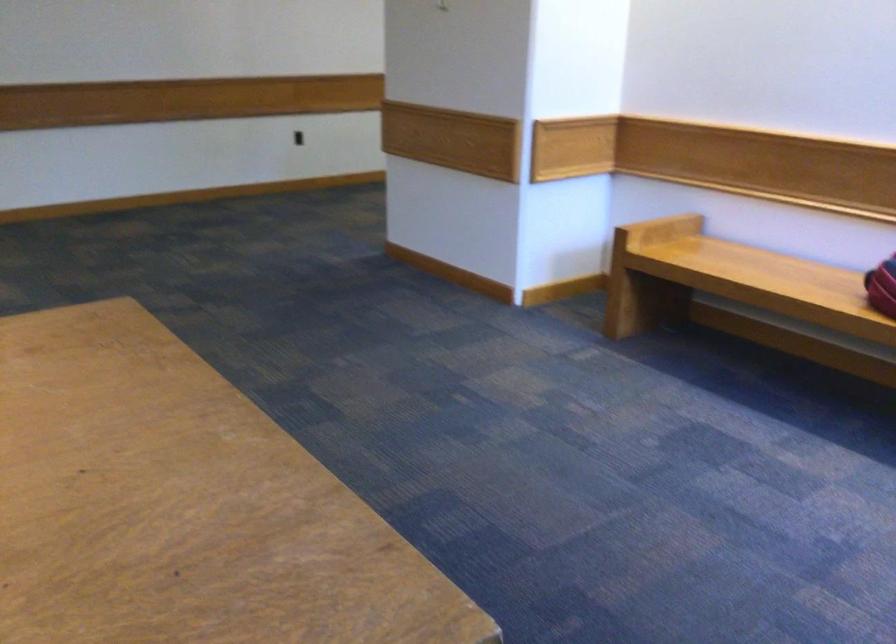
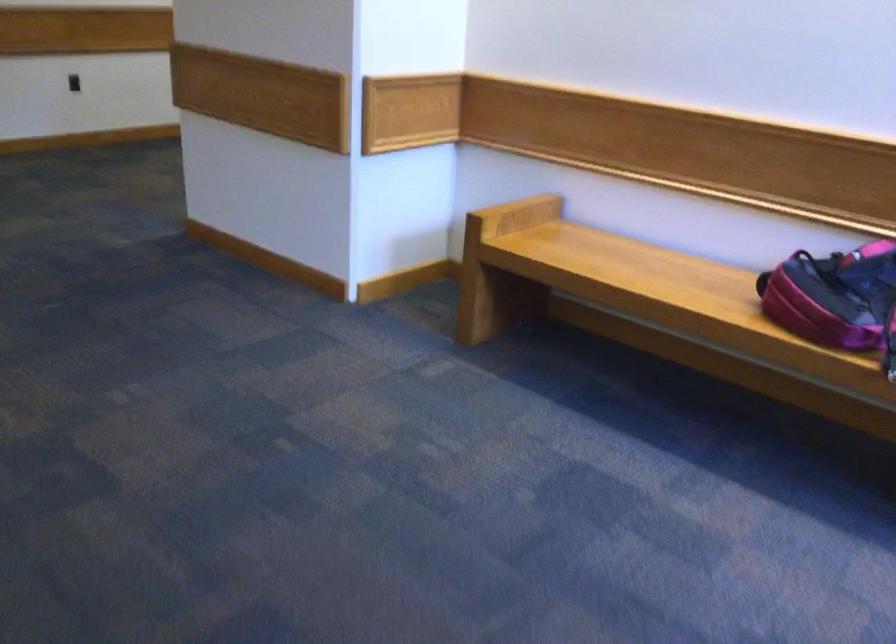
The point at [759,268] is marked in the first image. Where is the corresponding point in the second image?

(633, 270)